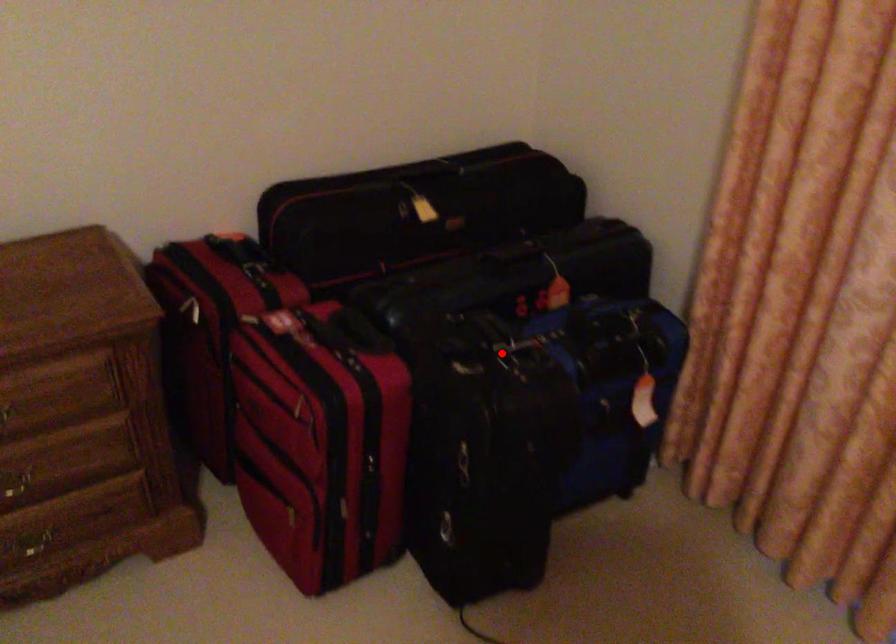
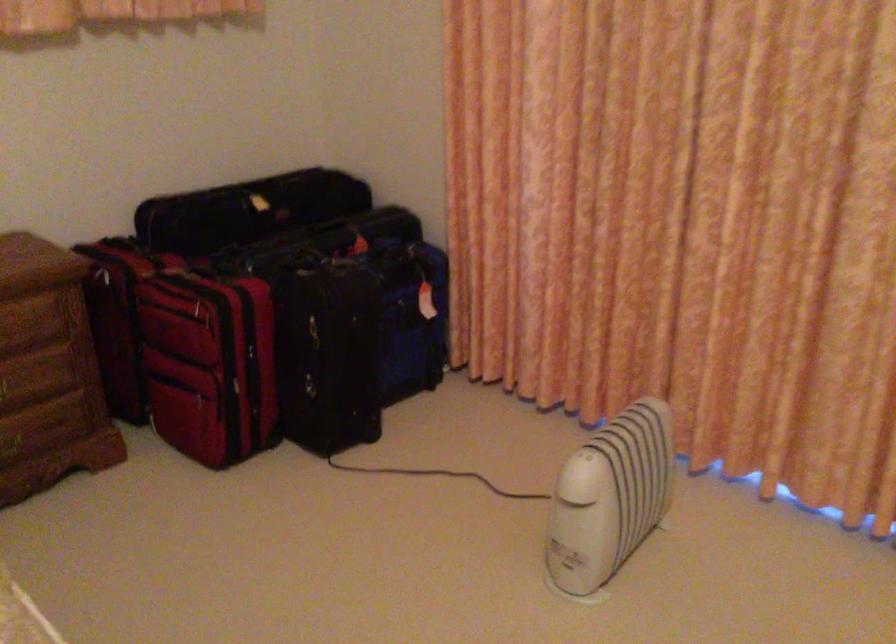
Question: I am providing you with two images of the same scene from different viewpoints. Given a red point in image1, look at the same physical point in image2. Is it:

Choices:
 (A) Closer to the viewpoint
 (B) Farther from the viewpoint

Answer: (B)